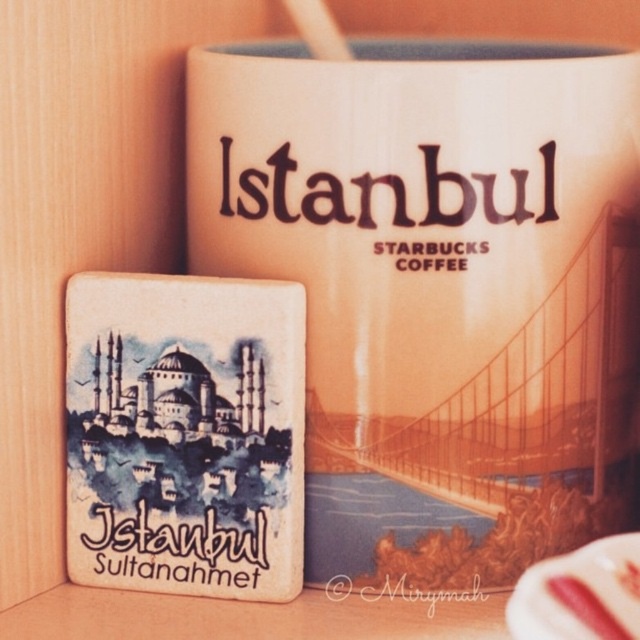
Question: Does matte ceramic mug at upper center appear on the left side of white glossy saucer at lower right?

Choices:
 (A) no
 (B) yes

Answer: (B)

Question: Which object appears closest to the camera in this image?

Choices:
 (A) matte ceramic mug at upper center
 (B) white glossy saucer at lower right

Answer: (B)

Question: Can you confirm if matte ceramic mug at upper center is thinner than white glossy saucer at lower right?

Choices:
 (A) no
 (B) yes

Answer: (A)

Question: Is matte ceramic mug at upper center positioned at the back of white glossy saucer at lower right?

Choices:
 (A) no
 (B) yes

Answer: (B)

Question: Which object is farther from the camera taking this photo?

Choices:
 (A) matte ceramic mug at upper center
 (B) white glossy saucer at lower right

Answer: (A)